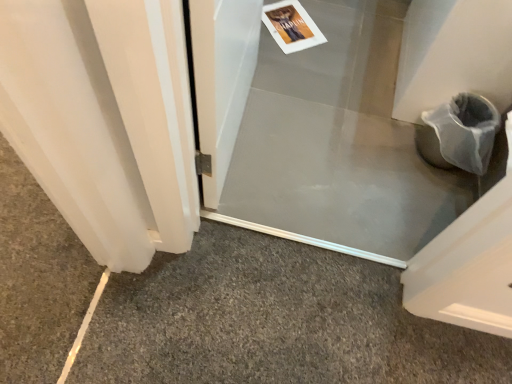
Where is `vacant area that lies to the right of clear plastic screen door at center, marked as the 1th screen door in a front-to-back arrangement`? The width and height of the screenshot is (512, 384). vacant area that lies to the right of clear plastic screen door at center, marked as the 1th screen door in a front-to-back arrangement is located at coordinates (315, 158).